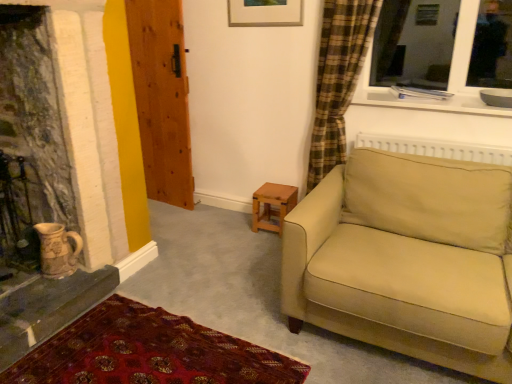
Locate an element on the screen. vacant space that's between beige fabric couch at right and wooden door at left is located at coordinates (222, 243).